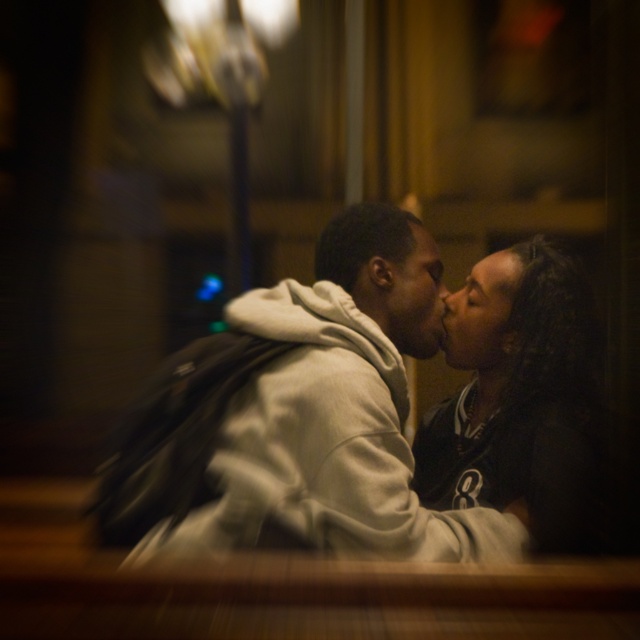
Question: Based on their relative distances, which object is nearer to the light gray hoodie at center?

Choices:
 (A) dark blue jersey at center
 (B) matte black forehead at upper center

Answer: (A)

Question: Can you confirm if light gray hoodie at center is thinner than dark blue jersey at center?

Choices:
 (A) no
 (B) yes

Answer: (A)

Question: Can you confirm if light gray hoodie at center is bigger than dark blue jersey at center?

Choices:
 (A) no
 (B) yes

Answer: (B)

Question: Is dark blue jersey at center smaller than matte black forehead at upper center?

Choices:
 (A) yes
 (B) no

Answer: (B)

Question: Which point is closer to the camera taking this photo?

Choices:
 (A) (388, 298)
 (B) (593, 429)

Answer: (B)

Question: Among these objects, which one is farthest from the camera?

Choices:
 (A) dark blue jersey at center
 (B) matte black forehead at upper center

Answer: (B)